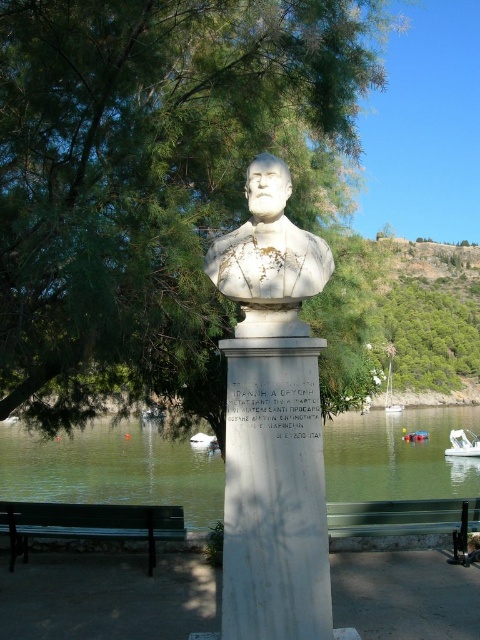
Question: Does green painted wood bench at lower left appear under white plastic boat at lower center?

Choices:
 (A) yes
 (B) no

Answer: (A)

Question: Among these points, which one is nearest to the camera?

Choices:
 (A) (19, 445)
 (B) (94, 534)
 (C) (335, 26)
 (D) (239, 506)

Answer: (D)

Question: Among these points, which one is farthest from the camera?

Choices:
 (A) (389, 403)
 (B) (228, 611)

Answer: (A)

Question: Based on their relative distances, which object is farther from the green water at lower center?

Choices:
 (A) white marble bust at center
 (B) white stone bust at center

Answer: (B)

Question: Does green leafy tree at upper left appear over green water at lower center?

Choices:
 (A) no
 (B) yes

Answer: (B)

Question: From the image, what is the correct spatial relationship of green leafy tree at upper left in relation to white marble bust at center?

Choices:
 (A) above
 (B) below

Answer: (A)